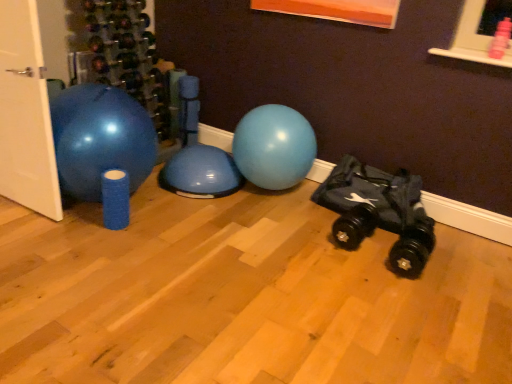
Question: Is white matte door at left situated inside black fabric baby carriage at lower right or outside?

Choices:
 (A) inside
 (B) outside

Answer: (B)

Question: In the image, is white matte door at left on the left side or the right side of black fabric baby carriage at lower right?

Choices:
 (A) right
 (B) left

Answer: (B)

Question: Is point (2, 39) closer or farther from the camera than point (409, 238)?

Choices:
 (A) closer
 (B) farther

Answer: (A)

Question: Is black fabric baby carriage at lower right in front of or behind white matte door at left in the image?

Choices:
 (A) front
 (B) behind

Answer: (B)

Question: From a real-world perspective, is black fabric baby carriage at lower right positioned above or below white matte door at left?

Choices:
 (A) below
 (B) above

Answer: (A)

Question: Considering the positions of black fabric baby carriage at lower right and white matte door at left in the image, is black fabric baby carriage at lower right wider or thinner than white matte door at left?

Choices:
 (A) wide
 (B) thin

Answer: (A)

Question: Which is correct: black fabric baby carriage at lower right is inside white matte door at left, or outside of it?

Choices:
 (A) inside
 (B) outside

Answer: (B)